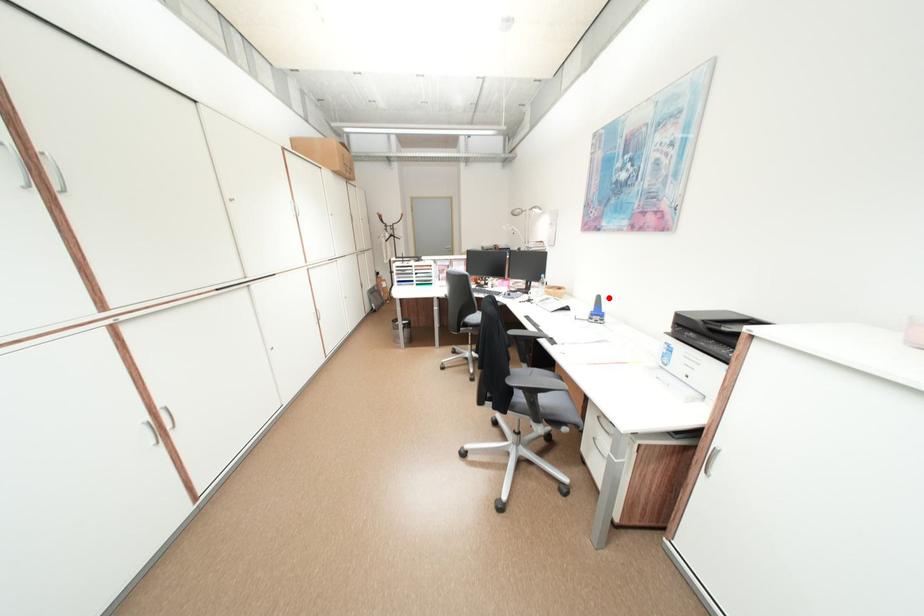
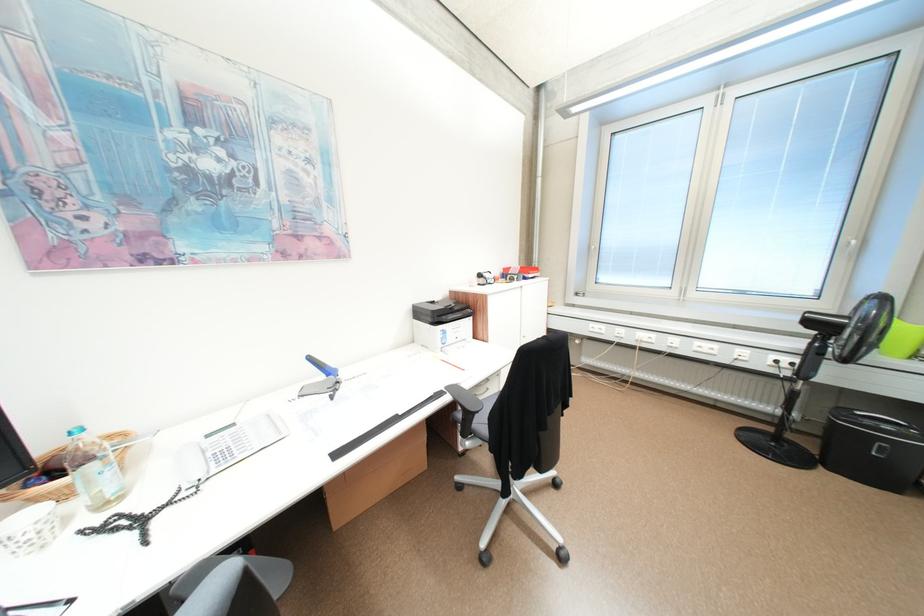
Find the pixel in the second image that matches the highlighted location in the first image.

(320, 359)